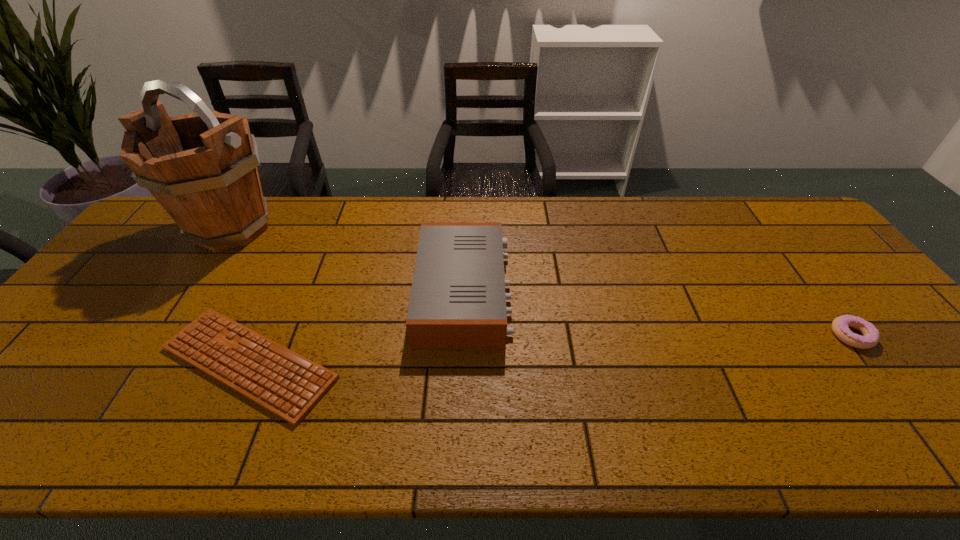
Where is `object that is the closest to the shortest object`? Image resolution: width=960 pixels, height=540 pixels. object that is the closest to the shortest object is located at coordinates (458, 302).

This screenshot has height=540, width=960. I want to click on vacant space that satisfies the following two spatial constraints: 1. on the control panel of the rightmost object; 2. on the left side of the radio receiver, so click(463, 335).

The height and width of the screenshot is (540, 960). Find the location of `free space that satisfies the following two spatial constraints: 1. on the control panel of the second tallest object; 2. on the back side of the third tallest object`. free space that satisfies the following two spatial constraints: 1. on the control panel of the second tallest object; 2. on the back side of the third tallest object is located at coordinates 463,335.

Find the location of a particular element. The height and width of the screenshot is (540, 960). free space that satisfies the following two spatial constraints: 1. on the front side of the bucket; 2. on the right side of the second shortest object is located at coordinates (161, 335).

The width and height of the screenshot is (960, 540). In order to click on free space that satisfies the following two spatial constraints: 1. on the front side of the tallest object; 2. on the left side of the rightmost object in this screenshot , I will do `click(161, 335)`.

At what (x,y) coordinates should I click in order to perform the action: click on vacant area that satisfies the following two spatial constraints: 1. on the control panel of the radio receiver; 2. on the front side of the shortest object. Please return your answer as a coordinate pair (x, y). Image resolution: width=960 pixels, height=540 pixels. Looking at the image, I should click on (462, 363).